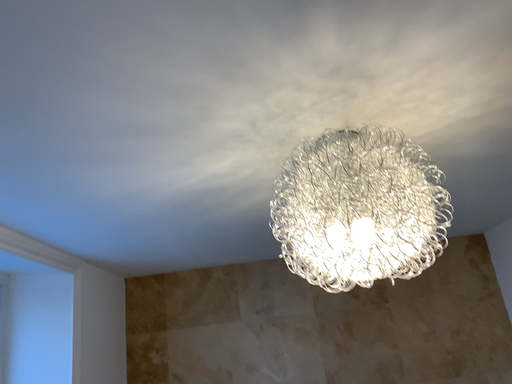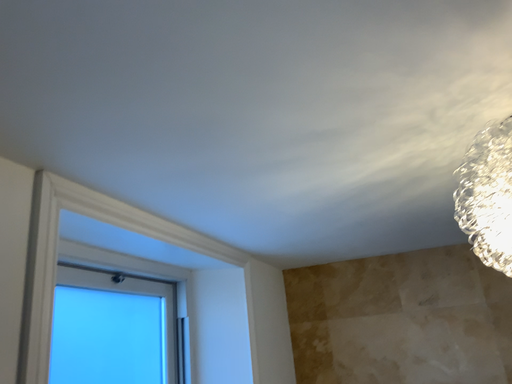
Question: How did the camera likely rotate when shooting the video?

Choices:
 (A) rotated right
 (B) rotated left

Answer: (B)